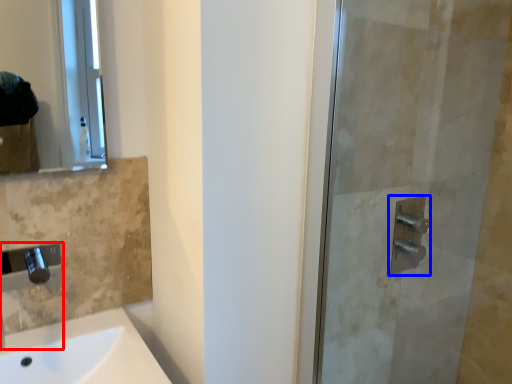
Question: Which object is closer to the camera taking this photo, faucet (highlighted by a red box) or shower (highlighted by a blue box)?

Choices:
 (A) faucet
 (B) shower

Answer: (A)